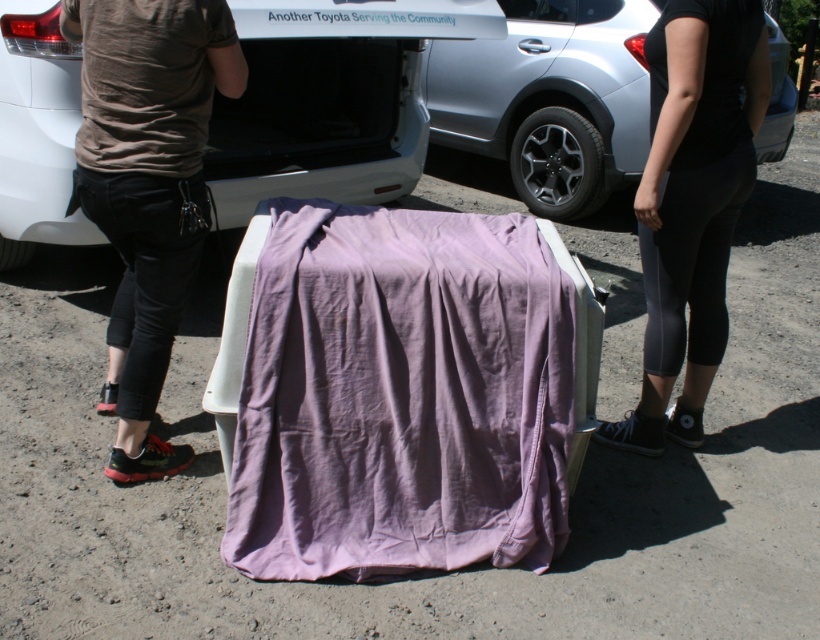
Question: Is brown cotton shirt at left below black fabric pants at lower right?

Choices:
 (A) no
 (B) yes

Answer: (B)

Question: Is purple cotton blanket at center thinner than black fabric pants at lower right?

Choices:
 (A) yes
 (B) no

Answer: (B)

Question: Can you confirm if purple cotton blanket at center is smaller than white matte car at center?

Choices:
 (A) yes
 (B) no

Answer: (A)

Question: Which of the following is the closest to the observer?

Choices:
 (A) purple cotton blanket at center
 (B) white matte car at center

Answer: (A)

Question: Which object is the closest to the white matte car at center?

Choices:
 (A) black fabric pants at lower right
 (B) silver metallic car at center
 (C) brown cotton shirt at left
 (D) purple cotton blanket at center

Answer: (B)

Question: Which object appears farthest from the camera in this image?

Choices:
 (A) black fabric pants at lower right
 (B) purple cotton blanket at center

Answer: (A)